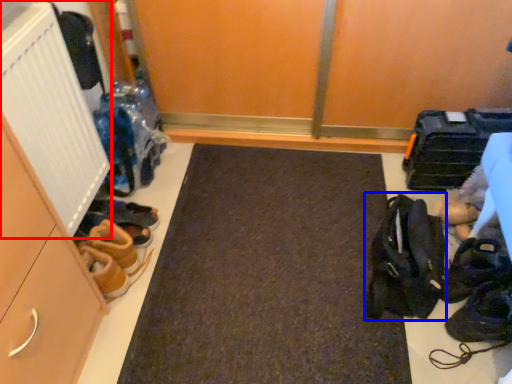
Question: Among these objects, which one is nearest to the camera, radiator (highlighted by a red box) or accessory (highlighted by a blue box)?

Choices:
 (A) radiator
 (B) accessory

Answer: (A)